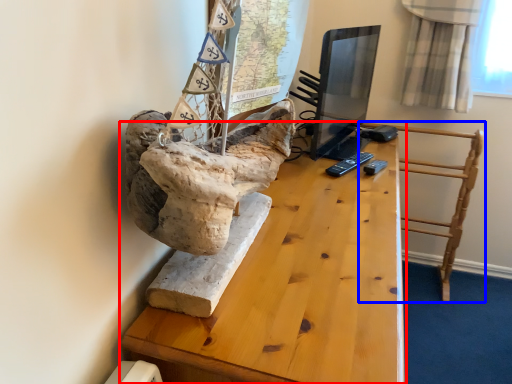
Question: Which point is closer to the camera, table (highlighted by a red box) or furniture (highlighted by a blue box)?

Choices:
 (A) table
 (B) furniture

Answer: (A)